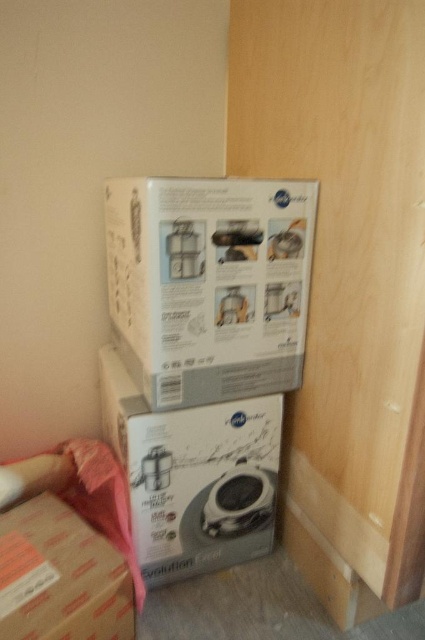
You are organizing a warehouse and need to place a new item between the white matte box at upper left and the brown cardboard at lower left. Based on their positions, which side should you place the new item to ensure it is between them?

The white matte box at upper left is to the right of the brown cardboard at lower left, so placing the new item between them would require positioning it to the right of the brown cardboard at lower left and to the left of the white matte box at upper left.

Consider the image. You are organizing a warehouse and need to place a new item between the white matte box at upper left and the brown cardboard at lower left. Which box should you place the new item closer to if you want it to be near the smaller object?

The brown cardboard at lower left is smaller than the white matte box at upper left, so you should place the new item closer to the brown cardboard at lower left to be near the smaller object.

You are organizing a warehouse and need to know the vertical arrangement of the boxes. Which box is placed higher up, the white matte box at upper left or the white glossy box at center?

The white matte box at upper left is placed higher up than the white glossy box at center according to the description.